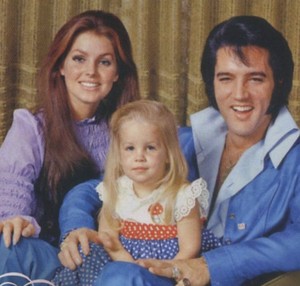
This screenshot has height=286, width=300. I want to click on armrest of chair, so click(285, 279).